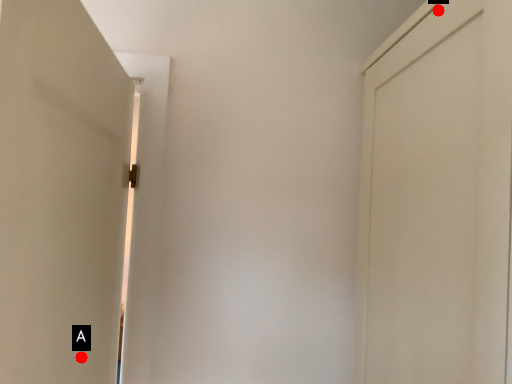
Question: Two points are circled on the image, labeled by A and B beside each circle. Which point appears closest to the camera in this image?

Choices:
 (A) A is closer
 (B) B is closer

Answer: (A)